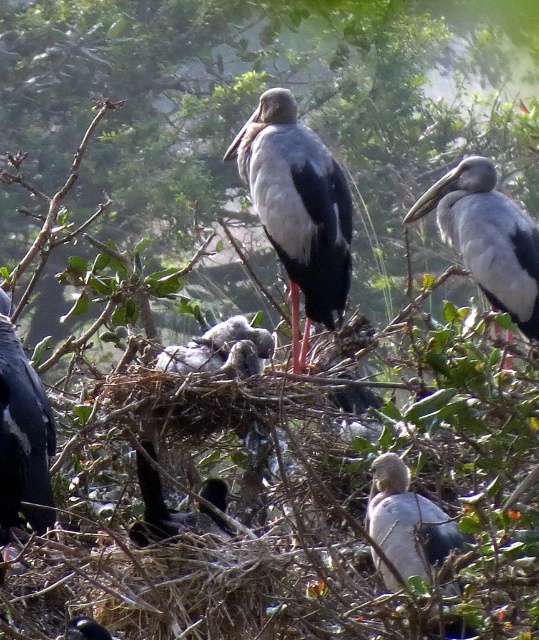
Can you confirm if gray matte stork at upper right is bigger than black glossy bird at center?

Yes.

The width and height of the screenshot is (539, 640). I want to click on gray matte stork at upper right, so [487, 237].

Who is more forward, [486,182] or [202,525]?

Positioned in front is point [202,525].

Locate an element on the screen. gray matte stork at upper right is located at coordinates (487, 237).

Image resolution: width=539 pixels, height=640 pixels. I want to click on gray matte bird at center, so 298,209.

Can you confirm if gray matte bird at center is thinner than gray downy feathers at center?

In fact, gray matte bird at center might be wider than gray downy feathers at center.

Locate an element on the screen. The height and width of the screenshot is (640, 539). gray matte bird at center is located at coordinates (298, 209).

Between point (9, 481) and point (155, 497), which one is positioned in front?

Point (9, 481) is more forward.

Can you confirm if matte black bird at left is shorter than black glossy bird at center?

No, matte black bird at left is not shorter than black glossy bird at center.

Is point (12, 412) less distant than point (226, 490)?

Yes.

Find the location of `matte black bird at left`. matte black bird at left is located at coordinates (x=23, y=436).